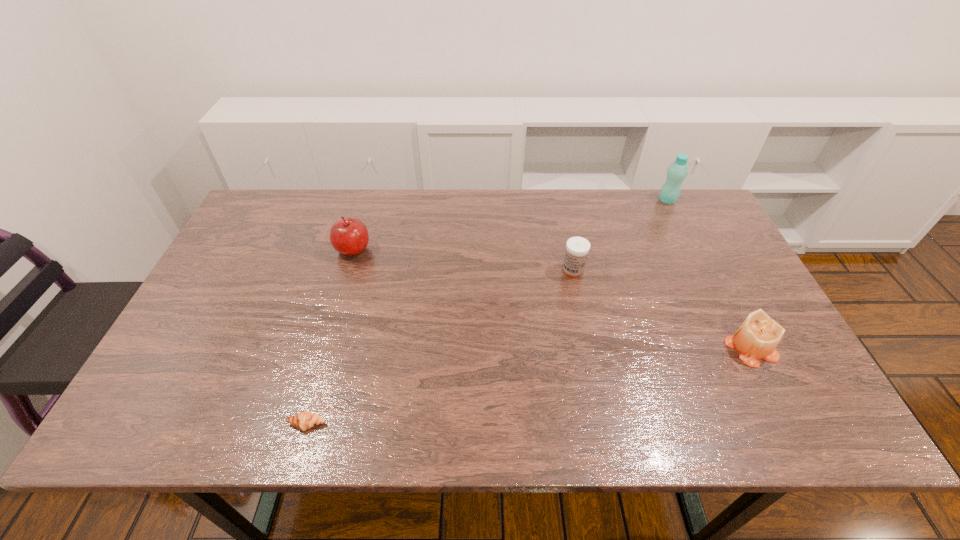
Identify the location of the farthest object. This screenshot has width=960, height=540. (677, 171).

Find the location of a particular element. the tallest object is located at coordinates (677, 171).

In order to click on apple in this screenshot , I will do `click(349, 236)`.

Locate an element on the screen. Image resolution: width=960 pixels, height=540 pixels. the second nearest object is located at coordinates click(x=757, y=337).

I want to click on medicine, so click(x=577, y=248).

Identify the location of the third object from left to right. This screenshot has width=960, height=540. (577, 248).

Image resolution: width=960 pixels, height=540 pixels. Find the location of `the shortest object`. the shortest object is located at coordinates (305, 420).

Locate an element on the screen. The height and width of the screenshot is (540, 960). pastry is located at coordinates (305, 420).

I want to click on vacant space situated on the left of the bottle, so click(611, 200).

Locate an element on the screen. Image resolution: width=960 pixels, height=540 pixels. vacant space situated 0.120m on the back of the apple is located at coordinates (364, 213).